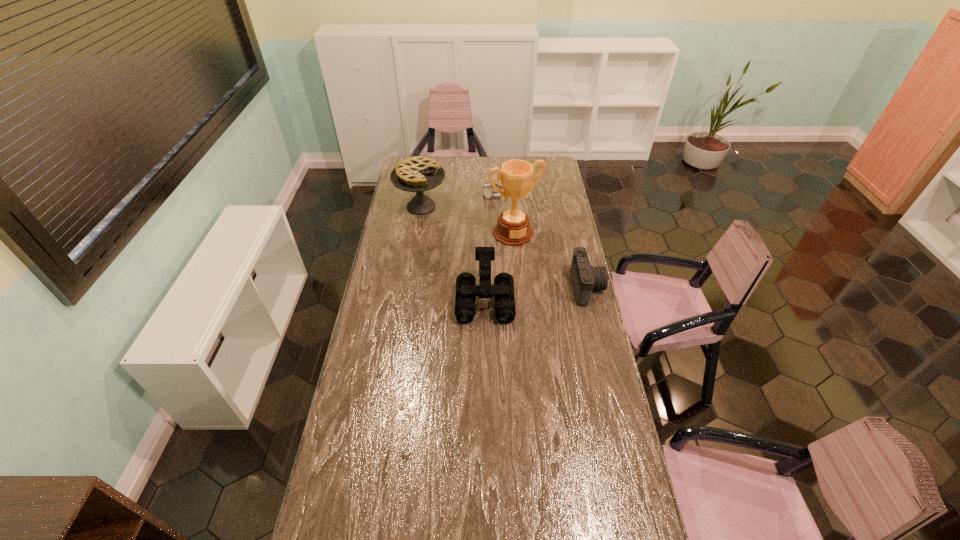
Identify the location of blank space at the near edge of the desktop. (426, 515).

Find the location of a particular element. The height and width of the screenshot is (540, 960). vacant space at the left edge of the desktop is located at coordinates (380, 393).

Where is `free spot at the right edge of the desktop`? free spot at the right edge of the desktop is located at coordinates (591, 377).

I want to click on free space at the near left corner, so click(370, 514).

You are a GUI agent. You are given a task and a screenshot of the screen. Output one action in this format:
    pyautogui.click(x=<x>, y=<y>)
    Task: Click on the empty space between the shortest object and the second shortest object
    
    Given the screenshot: What is the action you would take?
    pyautogui.click(x=540, y=241)

Identify the location of empty space that is in between the binoculars and the fourth shortest object. This screenshot has width=960, height=540. (453, 253).

In order to click on empty space that is in between the award and the fourth shortest object in this screenshot , I will do `click(467, 220)`.

Locate an element on the screen. free space between the third shortest object and the award is located at coordinates (499, 266).

The width and height of the screenshot is (960, 540). I want to click on free spot between the binoculars and the rightmost object, so 536,293.

This screenshot has width=960, height=540. What are the coordinates of `vacant area between the binoculars and the award` in the screenshot? It's located at (499, 266).